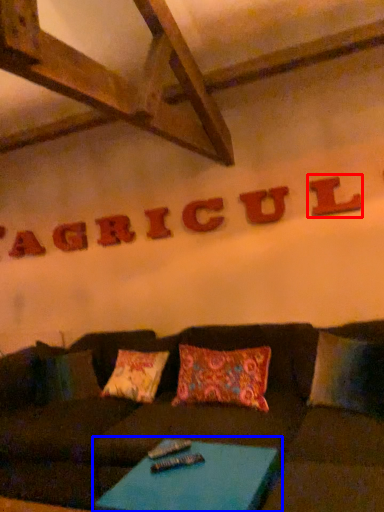
Question: Which object is further to the camera taking this photo, letter (highlighted by a red box) or table (highlighted by a blue box)?

Choices:
 (A) letter
 (B) table

Answer: (A)